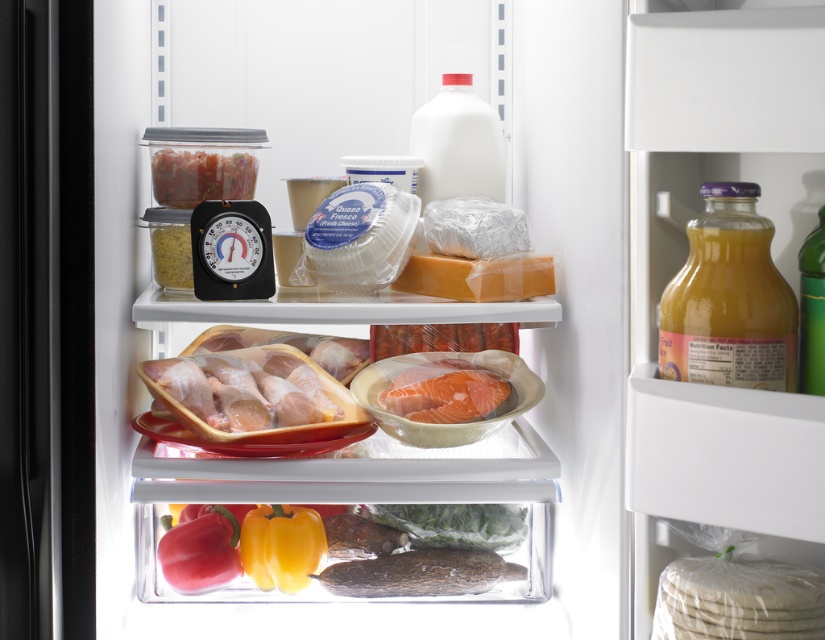
You are organizing items in the refrigerator and need to place a new item between the translucent plastic fish at lower center and the green glass bottle at right. Based on their positions, where should you place the new item?

The new item should be placed between the translucent plastic fish at lower center and the green glass bottle at right. Since the translucent plastic fish at lower center is located below the green glass bottle at right, the new item can be placed either above the fish or below the bottle, depending on the desired arrangement.

You are organizing the refrigerator and need to place the pinkish translucent salmon at center and the translucent plastic container at upper left. According to the image, where should you place the salmon relative to the container?

The pinkish translucent salmon at center should be placed below the translucent plastic container at upper left as it is located below it in the image.

You are organizing the contents of a refrigerator and need to place the pinkish translucent salmon at center and the translucent plastic container at upper left. Based on their positions, which item is situated closer to the front of the refrigerator?

The pinkish translucent salmon at center is closer to the viewer than the translucent plastic container at upper left, so it is situated closer to the front of the refrigerator.